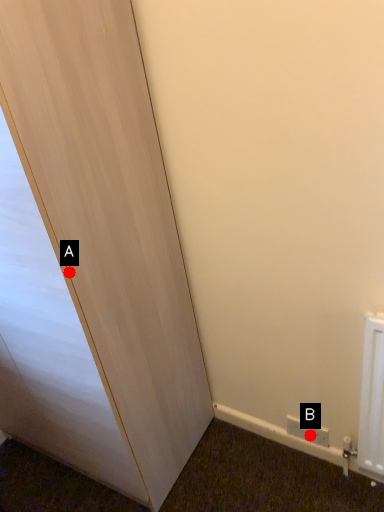
Question: Two points are circled on the image, labeled by A and B beside each circle. Which point is closer to the camera?

Choices:
 (A) A is closer
 (B) B is closer

Answer: (A)